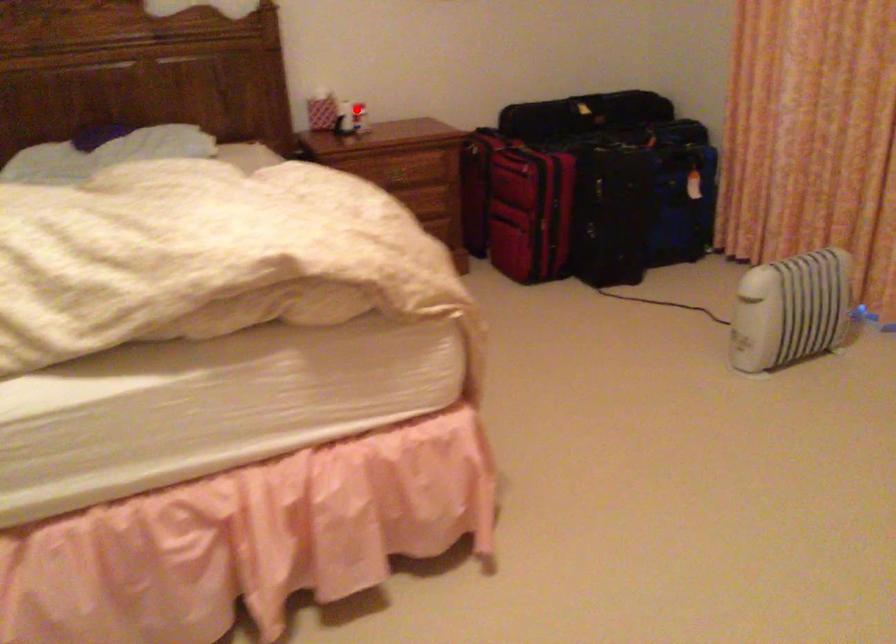
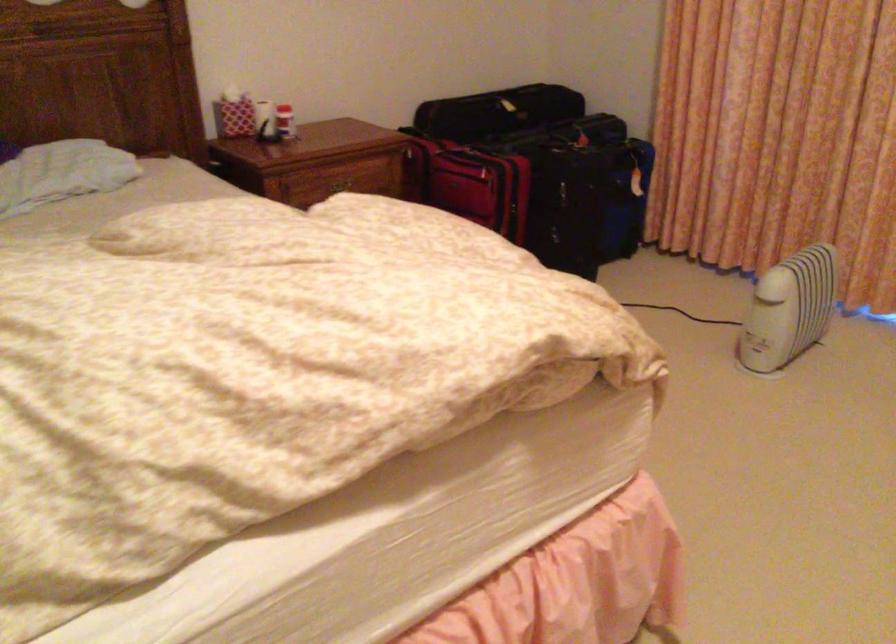
Question: A red point is marked in image1. In image2, is the corresponding 3D point closer to the camera or farther? Reply with the corresponding letter.

Choices:
 (A) The corresponding 3D point is closer.
 (B) The corresponding 3D point is farther.

Answer: (A)